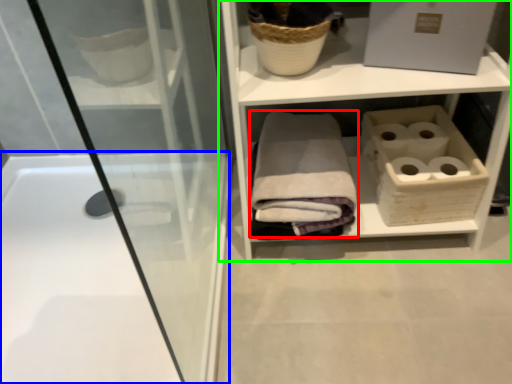
Question: Considering the real-world distances, which object is farthest from bath towel (highlighted by a red box)? bathtub (highlighted by a blue box) or shelf (highlighted by a green box)?

Choices:
 (A) bathtub
 (B) shelf

Answer: (A)